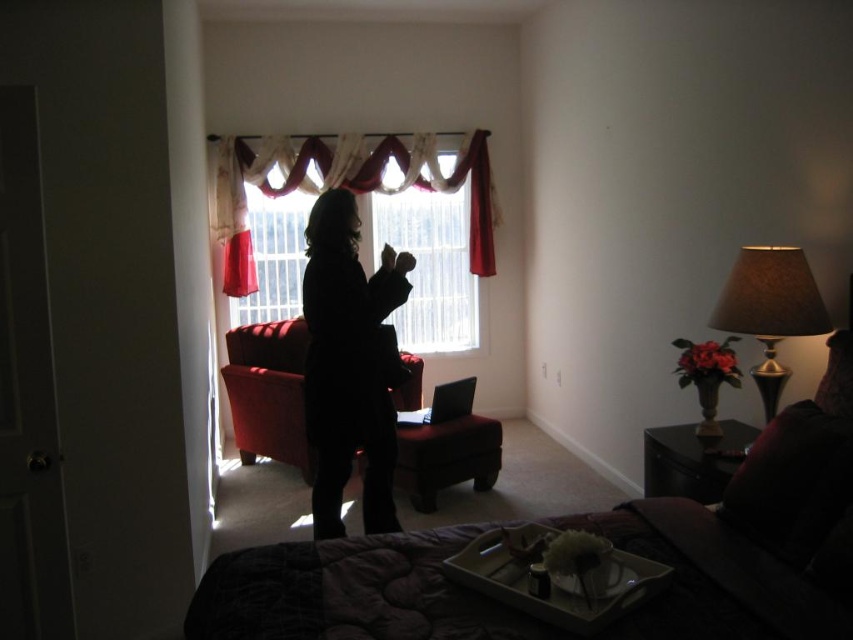
Which of these two, velvet red armchair at center or brown fabric lampshade at right, stands taller?

velvet red armchair at center is taller.

Describe the element at coordinates (268, 392) in the screenshot. The width and height of the screenshot is (853, 640). I see `velvet red armchair at center` at that location.

Locate an element on the screen. The height and width of the screenshot is (640, 853). velvet red armchair at center is located at coordinates (268, 392).

Who is more distant from viewer, (679, 637) or (482, 262)?

The point (482, 262) is more distant.

Does dark fabric bed at center have a smaller size compared to velvet-like red curtains at center?

Actually, dark fabric bed at center might be larger than velvet-like red curtains at center.

Which is in front, point (448, 576) or point (474, 177)?

Point (448, 576)

In order to click on dark fabric bed at center in this screenshot , I will do `click(749, 541)`.

Where is `velvet-like red curtains at center`? velvet-like red curtains at center is located at coordinates (344, 184).

Who is more distant from viewer, [281,154] or [721,314]?

The point [281,154] is behind.

Where is `velvet-like red curtains at center`? The width and height of the screenshot is (853, 640). velvet-like red curtains at center is located at coordinates (344, 184).

This screenshot has width=853, height=640. Identify the location of velvet-like red curtains at center. (344, 184).